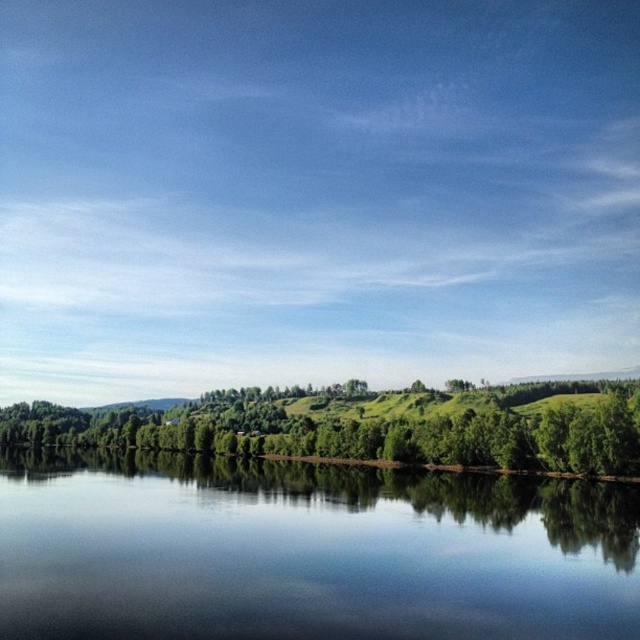
You are standing at the edge of the scene and want to reach the transparent water at center. According to the coordinates provided, in which direction should you move relative to your current position?

The transparent water at center is located at coordinates point (307, 552), so you should move towards the center of the scene to reach it.